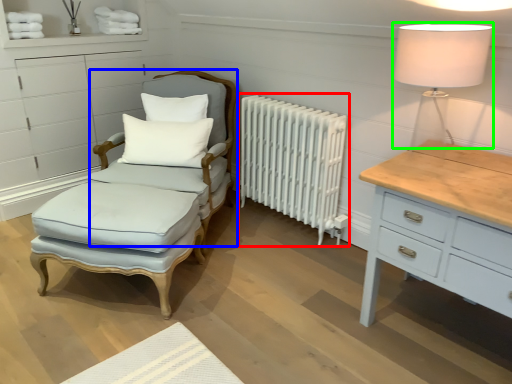
Question: Which object is the farthest from radiator (highlighted by a red box)? Choose among these: swivel chair (highlighted by a blue box) or table lamp (highlighted by a green box).

Choices:
 (A) swivel chair
 (B) table lamp

Answer: (B)